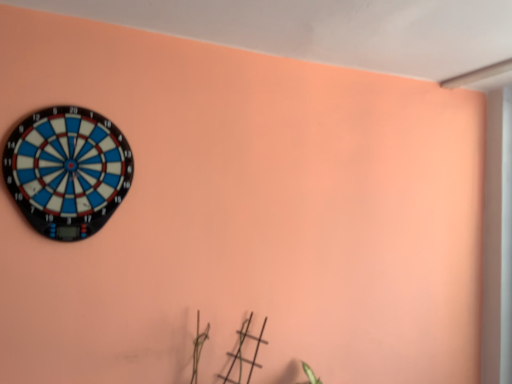
Locate an element on the screen. This screenshot has height=384, width=512. blue plastic dartboard at upper left is located at coordinates (67, 171).

This screenshot has height=384, width=512. What do you see at coordinates (67, 171) in the screenshot?
I see `blue plastic dartboard at upper left` at bounding box center [67, 171].

The width and height of the screenshot is (512, 384). In order to click on blue plastic dartboard at upper left in this screenshot , I will do `click(67, 171)`.